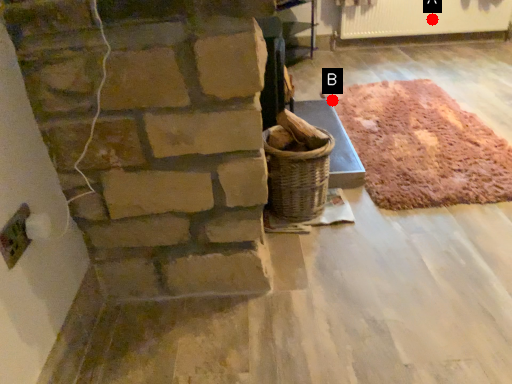
Question: Two points are circled on the image, labeled by A and B beside each circle. Which point is closer to the camera taking this photo?

Choices:
 (A) A is closer
 (B) B is closer

Answer: (B)